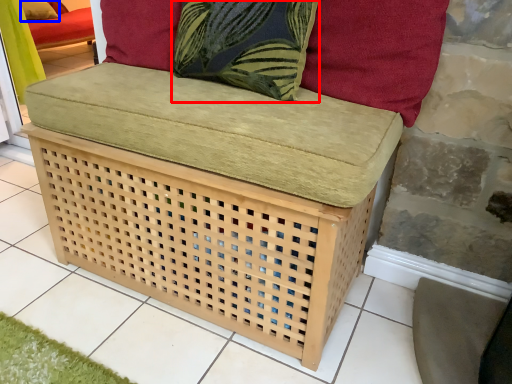
Question: Which of the following is the farthest to the observer, throw pillow (highlighted by a red box) or pillow (highlighted by a blue box)?

Choices:
 (A) throw pillow
 (B) pillow

Answer: (B)